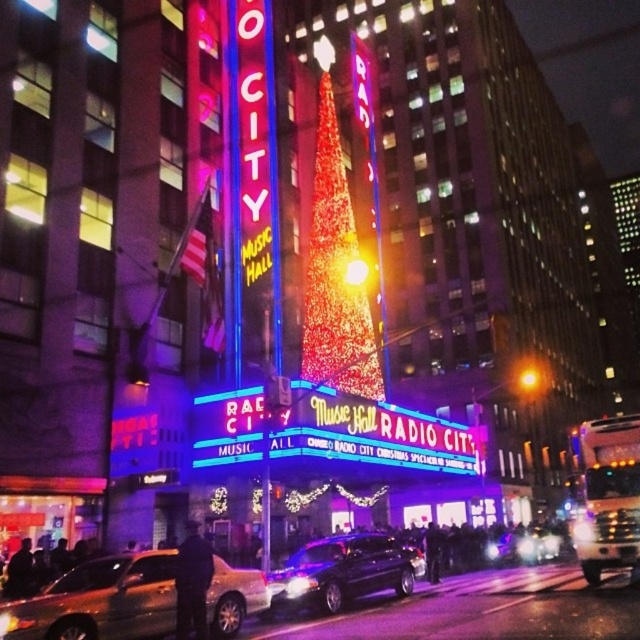
You are a valet parking attendant and need to park both the shiny black sedan at center and the metallic silver car at center in a parking spot that is 2 meters wide. Which car can fit into the parking spot without overlapping the lines?

The shiny black sedan at center has a lesser width compared to metallic silver car at center, so the shiny black sedan at center can fit into the parking spot without overlapping the lines.